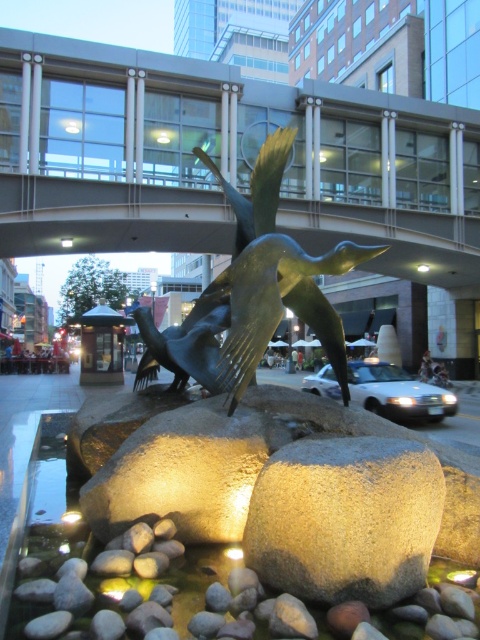
Is smooth gray rock at center wider than bronze sculpture at center?

Indeed, smooth gray rock at center has a greater width compared to bronze sculpture at center.

Is the position of smooth gray rock at center more distant than that of bronze sculpture at center?

No, it is not.

Is point (322, 563) in front of point (288, 241)?

Yes, it is in front of point (288, 241).

The image size is (480, 640). Find the location of `smooth gray rock at center`. smooth gray rock at center is located at coordinates (346, 518).